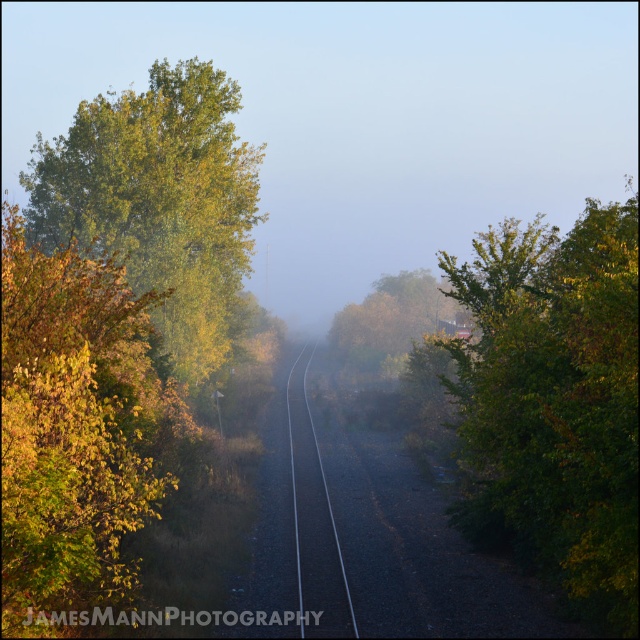
Does point (35, 259) come behind point (328, 529)?

No.

Between point (13, 515) and point (326, 612), which one is positioned in front?

Point (13, 515) is in front.

Where is `golden foliage at left`? This screenshot has width=640, height=640. golden foliage at left is located at coordinates (76, 426).

Between point (529, 250) and point (168, 241), which one is positioned in front?

Point (529, 250) is more forward.

Between green leafy tree at right and green leafy tree at left, which one is positioned higher?

Positioned higher is green leafy tree at left.

Between point (604, 298) and point (218, 212), which one is positioned behind?

Point (218, 212)

Where is `green leafy tree at right`? green leafy tree at right is located at coordinates (554, 403).

Does foggy mist at center appear on the left side of golden foliage at left?

Correct, you'll find foggy mist at center to the left of golden foliage at left.

Who is lower down, foggy mist at center or golden foliage at left?

golden foliage at left is lower down.

What do you see at coordinates (360, 118) in the screenshot? The height and width of the screenshot is (640, 640). I see `foggy mist at center` at bounding box center [360, 118].

Image resolution: width=640 pixels, height=640 pixels. I want to click on foggy mist at center, so coord(360,118).